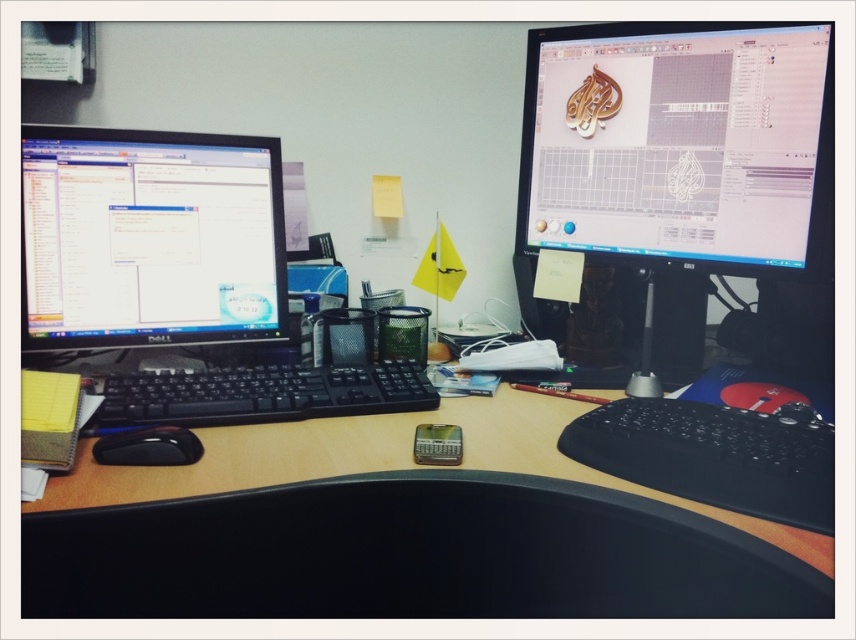
Is matte black monitor at upper right further to the viewer compared to black glossy monitor at left?

No, matte black monitor at upper right is closer to the viewer.

Which is in front, point (804, 195) or point (162, 186)?

Point (804, 195) is more forward.

This screenshot has height=640, width=856. What do you see at coordinates (675, 163) in the screenshot?
I see `matte black monitor at upper right` at bounding box center [675, 163].

Locate an element on the screen. This screenshot has height=640, width=856. matte black monitor at upper right is located at coordinates (675, 163).

Does black rubberized keyboard at lower right have a smaller size compared to black plastic keyboard at center?

Incorrect, black rubberized keyboard at lower right is not smaller in size than black plastic keyboard at center.

Which is more to the right, black rubberized keyboard at lower right or black plastic keyboard at center?

black rubberized keyboard at lower right is more to the right.

Where is `black rubberized keyboard at lower right`? The width and height of the screenshot is (856, 640). black rubberized keyboard at lower right is located at coordinates (712, 456).

I want to click on black rubberized keyboard at lower right, so click(x=712, y=456).

Is black glossy monitor at left to the right of black rubberized keyboard at lower right from the viewer's perspective?

Incorrect, black glossy monitor at left is not on the right side of black rubberized keyboard at lower right.

In order to click on black glossy monitor at left in this screenshot , I will do `click(149, 237)`.

The width and height of the screenshot is (856, 640). In order to click on black glossy monitor at left in this screenshot , I will do `click(149, 237)`.